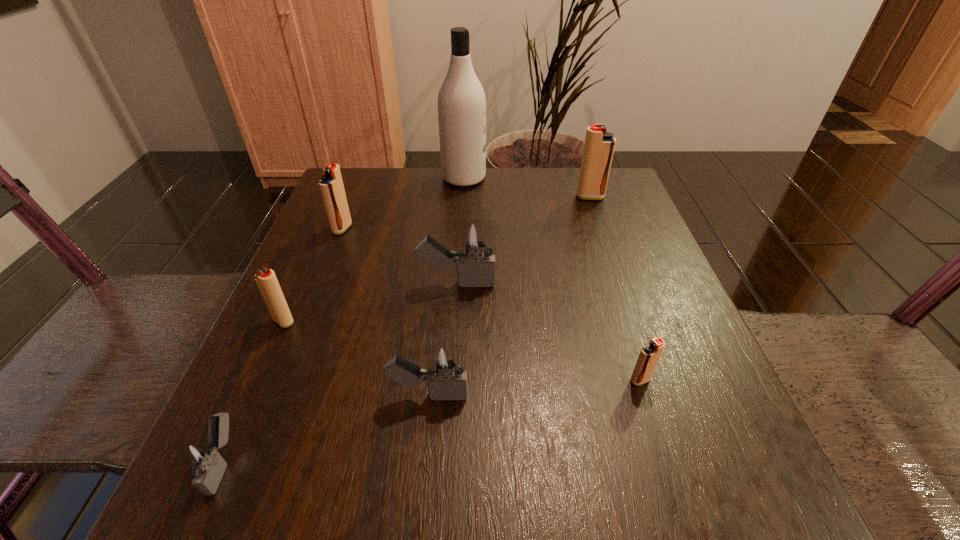
Locate an element on the screen. The width and height of the screenshot is (960, 540). the fourth nearest object is located at coordinates (266, 280).

The width and height of the screenshot is (960, 540). Find the location of `the smallest red igniter`. the smallest red igniter is located at coordinates (649, 356).

Identify the location of the nearest gray igniter. click(x=201, y=461).

The width and height of the screenshot is (960, 540). What are the coordinates of `the smallest gray igniter` in the screenshot? It's located at click(x=201, y=461).

Where is `vacant space situated on the front-facing side of the farthest object`? The width and height of the screenshot is (960, 540). vacant space situated on the front-facing side of the farthest object is located at coordinates (517, 178).

Locate an element on the screen. This screenshot has width=960, height=540. vacant space located on the left of the biggest red igniter is located at coordinates (547, 197).

Locate an element on the screen. The image size is (960, 540). vacant space located on the front of the second farthest red igniter is located at coordinates (295, 349).

Where is `free spot located 0.080m on the back of the third farthest igniter`? free spot located 0.080m on the back of the third farthest igniter is located at coordinates (459, 245).

Identify the location of free space located 0.360m on the back of the second biggest gray igniter. This screenshot has width=960, height=540. point(444,237).

Locate an element on the screen. The width and height of the screenshot is (960, 540). blank space located on the front of the fourth farthest igniter is located at coordinates (253, 389).